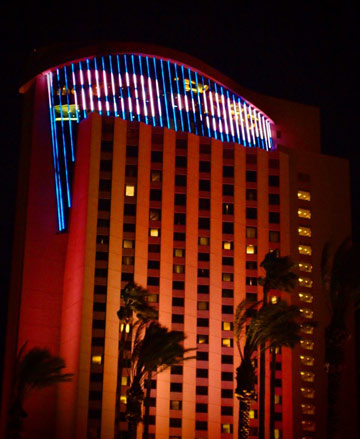
Identify the location of aparments with no lights on. The height and width of the screenshot is (439, 360). (204, 228), (229, 208), (250, 209), (276, 201), (273, 180), (181, 164), (105, 144).